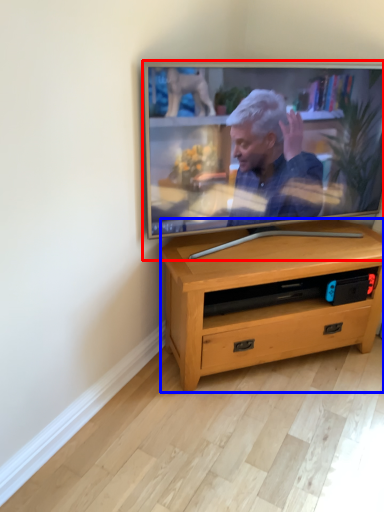
Question: Which point is closer to the camera, television (highlighted by a red box) or desk (highlighted by a blue box)?

Choices:
 (A) television
 (B) desk

Answer: (A)